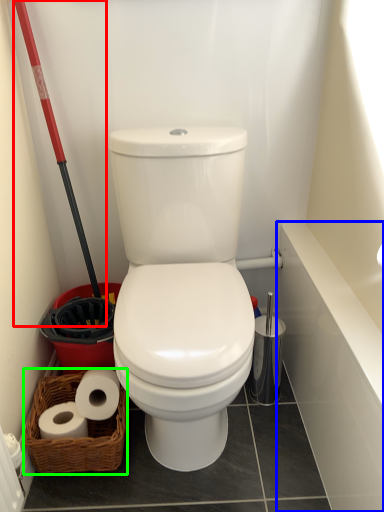
Question: Based on their relative distances, which object is nearer to shovel (highlighted by a red box)? Choose from bath (highlighted by a blue box) and basket (highlighted by a green box).

Choices:
 (A) bath
 (B) basket

Answer: (B)